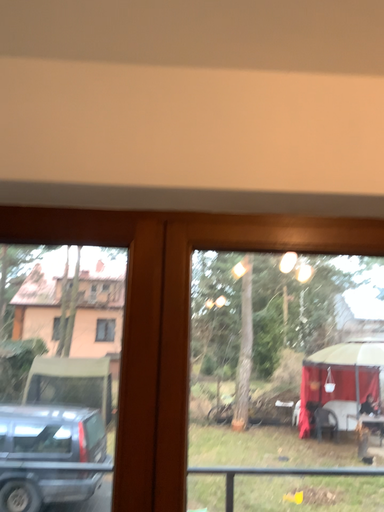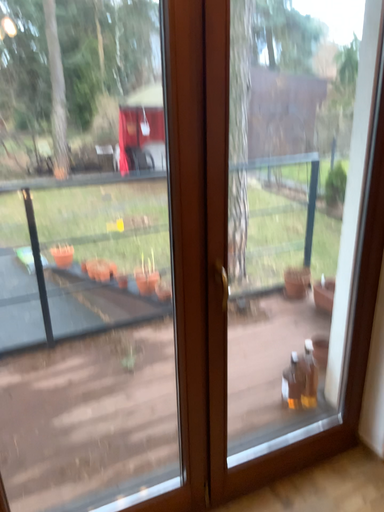
Question: Which way did the camera rotate in the video?

Choices:
 (A) rotated left
 (B) rotated right

Answer: (B)